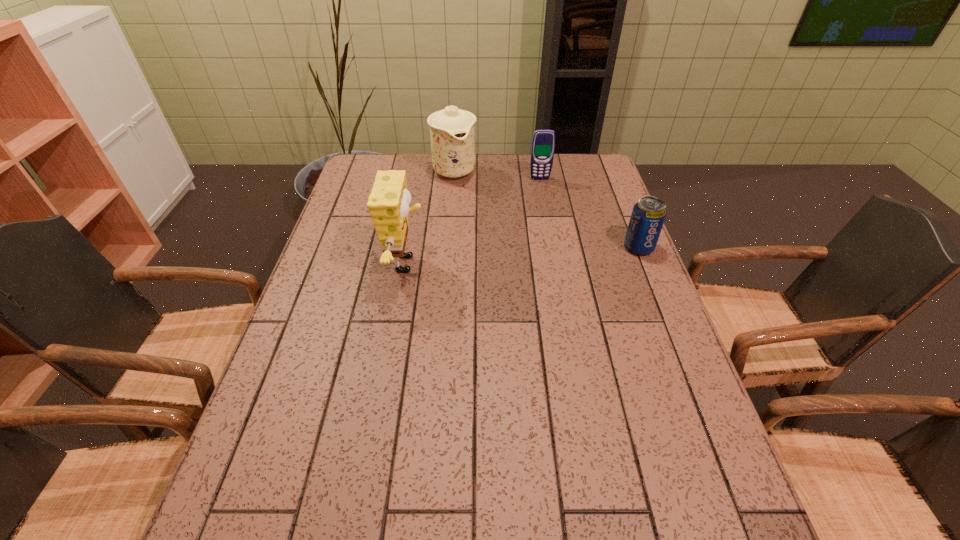
Find the location of a particular element. vacant area situated 0.060m on the spout of the chinaware is located at coordinates (468, 195).

The image size is (960, 540). Identify the location of vacant space located 0.140m on the spout of the chinaware. (475, 208).

Where is `vacant point located on the spout of the chinaware`? vacant point located on the spout of the chinaware is located at coordinates (488, 227).

Locate an element on the screen. The height and width of the screenshot is (540, 960). cellular telephone that is at the far edge is located at coordinates (543, 142).

This screenshot has height=540, width=960. Find the location of `chinaware located at the far edge`. chinaware located at the far edge is located at coordinates (452, 131).

Where is `object that is at the right edge`? The image size is (960, 540). object that is at the right edge is located at coordinates (648, 215).

Find the location of a particular element. vacant space at the near edge of the desktop is located at coordinates (554, 468).

Identify the location of vacant region at the left edge. This screenshot has height=540, width=960. (314, 355).

Find the location of a particular element. The image size is (960, 540). free region at the right edge of the desktop is located at coordinates (595, 199).

This screenshot has height=540, width=960. Find the location of `vacant space at the far left corner of the desktop`. vacant space at the far left corner of the desktop is located at coordinates (370, 154).